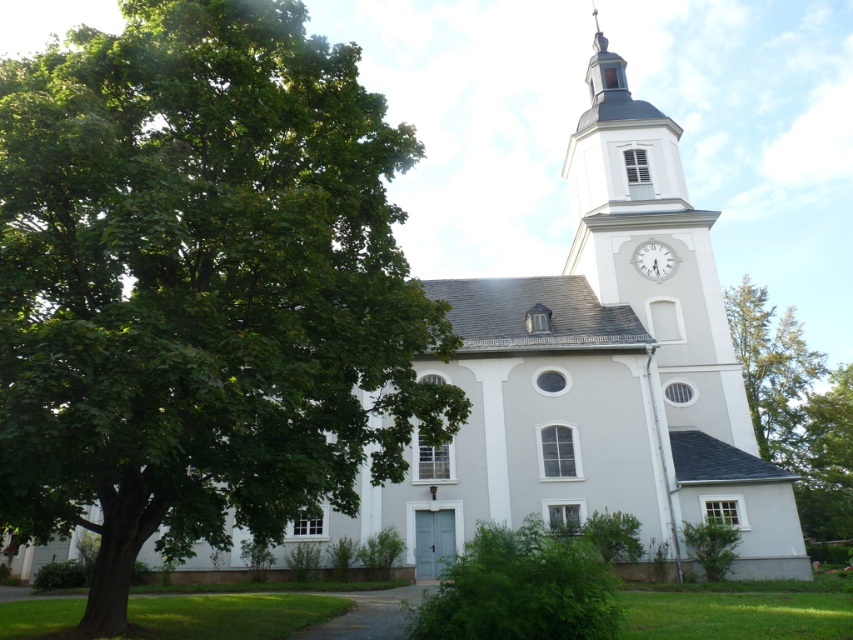
Question: Which object is the farthest from the white glossy clock at upper center?

Choices:
 (A) green leafy tree at right
 (B) smooth gray spire at upper center

Answer: (A)

Question: Which object appears closest to the camera in this image?

Choices:
 (A) green leafy tree at right
 (B) white glossy clock at upper center

Answer: (A)

Question: Does green leafy tree at left come behind smooth gray spire at upper center?

Choices:
 (A) no
 (B) yes

Answer: (A)

Question: Which object is the closest to the white glossy clock at upper center?

Choices:
 (A) white smooth clock tower at upper right
 (B) green leafy tree at right

Answer: (A)

Question: Is white smooth clock tower at upper right closer to camera compared to green leafy tree at right?

Choices:
 (A) no
 (B) yes

Answer: (A)

Question: Is green leafy tree at right in front of smooth gray spire at upper center?

Choices:
 (A) yes
 (B) no

Answer: (A)